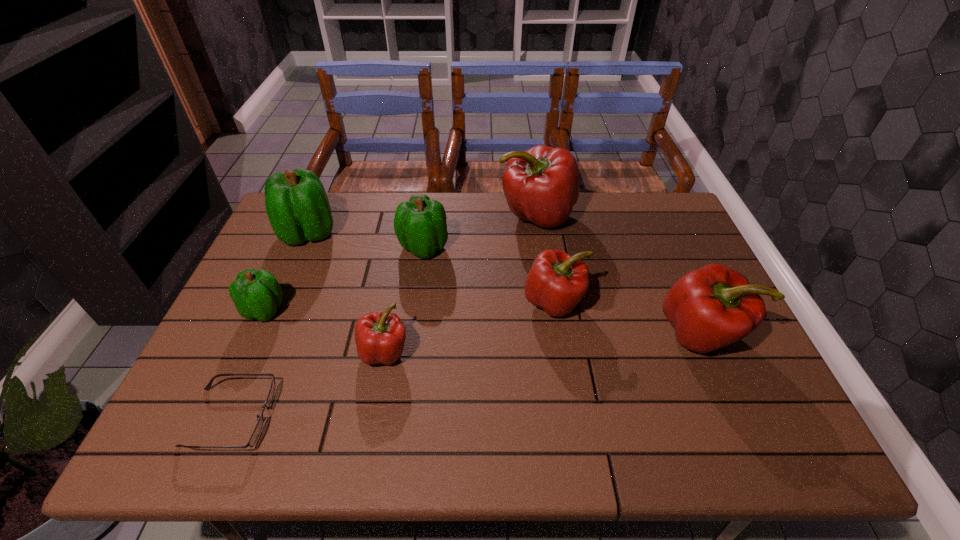
Point out which pink bell pepper is positioned as the second nearest to the nearest green bell pepper. Please provide its 2D coordinates. Your answer should be formatted as a tuple, i.e. [(x, y)], where the tuple contains the x and y coordinates of a point satisfying the conditions above.

[(541, 185)]

Where is `the closest green bell pepper relative to the rightmost bell pepper`? the closest green bell pepper relative to the rightmost bell pepper is located at coordinates (420, 225).

Identify which green bell pepper is the second closest to the second smallest pink bell pepper. Please provide its 2D coordinates. Your answer should be formatted as a tuple, i.e. [(x, y)], where the tuple contains the x and y coordinates of a point satisfying the conditions above.

[(297, 205)]

Image resolution: width=960 pixels, height=540 pixels. I want to click on vacant area in the image that satisfies the following two spatial constraints: 1. on the front side of the biggest green bell pepper; 2. on the left side of the rightmost green bell pepper, so click(x=302, y=247).

Find the location of `vacant position in the image that satisfies the following two spatial constraints: 1. on the front side of the biggest pink bell pepper; 2. on the left side of the rightmost object`. vacant position in the image that satisfies the following two spatial constraints: 1. on the front side of the biggest pink bell pepper; 2. on the left side of the rightmost object is located at coordinates (553, 334).

Find the location of a particular element. The height and width of the screenshot is (540, 960). vacant area that satisfies the following two spatial constraints: 1. on the back side of the second biggest green bell pepper; 2. on the right side of the smallest green bell pepper is located at coordinates (294, 247).

The height and width of the screenshot is (540, 960). Identify the location of vacant area in the image that satisfies the following two spatial constraints: 1. on the front side of the smallest green bell pepper; 2. on the left side of the smallest pink bell pepper. (247, 352).